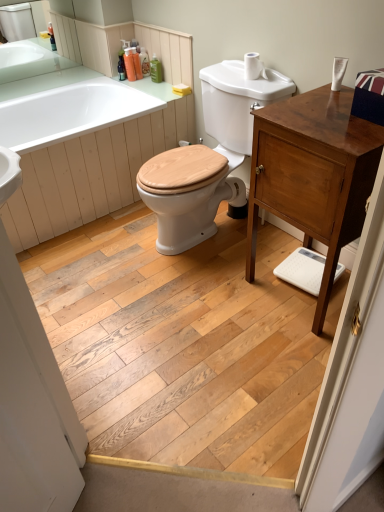
Find the location of `vacant space to the right of natural wood screen door at lower left`. vacant space to the right of natural wood screen door at lower left is located at coordinates (123, 321).